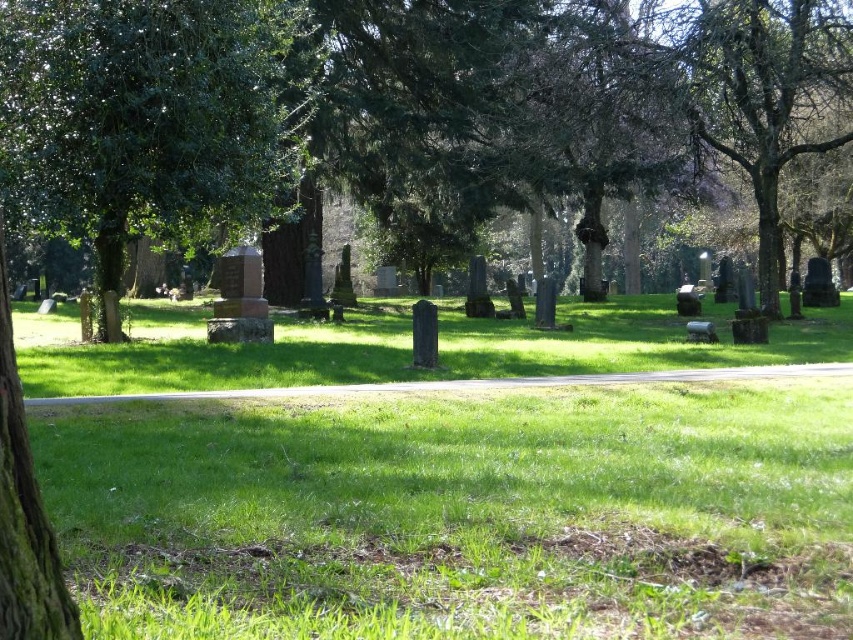
Question: Is green leafy tree at center above green leafy tree at left?

Choices:
 (A) no
 (B) yes

Answer: (B)

Question: Is green leafy tree at center smaller than green leafy tree at left?

Choices:
 (A) no
 (B) yes

Answer: (A)

Question: Among these points, which one is nearest to the camera?

Choices:
 (A) (300, 36)
 (B) (99, 186)

Answer: (B)

Question: Does green leafy tree at center appear over green leafy tree at left?

Choices:
 (A) no
 (B) yes

Answer: (B)